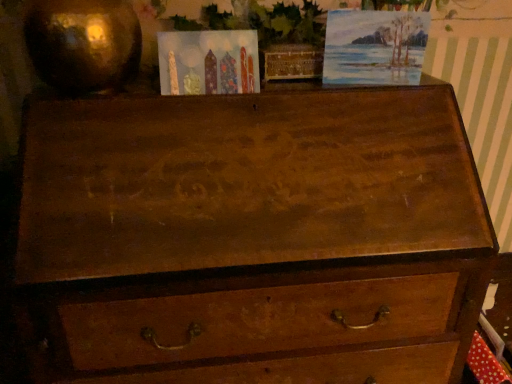
Where is `free space that is to the left of matte paper postcard at upper center`? free space that is to the left of matte paper postcard at upper center is located at coordinates (116, 91).